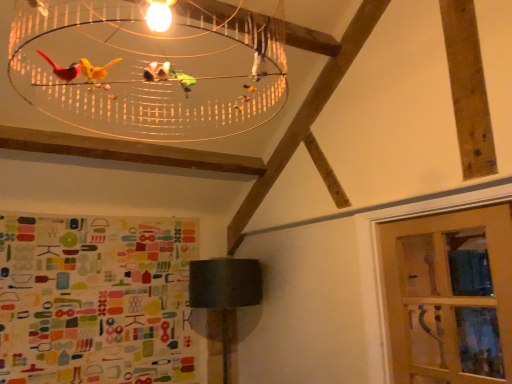
What is the approximate width of translucent plastic birdcage at upper center?

28.00 inches.

The image size is (512, 384). Describe the element at coordinates (225, 291) in the screenshot. I see `matte black lampshade at lower center` at that location.

Describe the element at coordinates (450, 296) in the screenshot. I see `clear glass door at lower right` at that location.

Find the location of `translucent plastic birdcage at upper center`. translucent plastic birdcage at upper center is located at coordinates (149, 70).

Between clear glass door at lower right and translucent plastic birdcage at upper center, which one appears on the left side from the viewer's perspective?

translucent plastic birdcage at upper center is more to the left.

From a real-world perspective, relative to translucent plastic birdcage at upper center, is clear glass door at lower right vertically above or below?

clear glass door at lower right is below translucent plastic birdcage at upper center.

Is clear glass door at lower right in contact with translucent plastic birdcage at upper center?

clear glass door at lower right and translucent plastic birdcage at upper center are not in contact.

Image resolution: width=512 pixels, height=384 pixels. Find the location of `door beneath the translucent plastic birdcage at upper center (from a real-world perspective)`. door beneath the translucent plastic birdcage at upper center (from a real-world perspective) is located at coordinates (450, 296).

Which of these two, translucent plastic birdcage at upper center or matte black lampshade at lower center, is smaller?

Smaller between the two is matte black lampshade at lower center.

How distant is translucent plastic birdcage at upper center from matte black lampshade at lower center?

translucent plastic birdcage at upper center is 1.60 meters from matte black lampshade at lower center.

Is translucent plastic birdcage at upper center shorter than matte black lampshade at lower center?

Indeed, translucent plastic birdcage at upper center has a lesser height compared to matte black lampshade at lower center.

From the image's perspective, which one is positioned higher, translucent plastic birdcage at upper center or matte black lampshade at lower center?

translucent plastic birdcage at upper center, from the image's perspective.

Is clear glass door at lower right with matte black lampshade at lower center?

There is a gap between clear glass door at lower right and matte black lampshade at lower center.

Who is smaller, clear glass door at lower right or matte black lampshade at lower center?

Smaller between the two is clear glass door at lower right.

From a real-world perspective, is clear glass door at lower right above or below matte black lampshade at lower center?

Clearly, from a real-world perspective, clear glass door at lower right is above matte black lampshade at lower center.

Considering the relative positions of clear glass door at lower right and matte black lampshade at lower center in the image provided, is clear glass door at lower right to the left of matte black lampshade at lower center from the viewer's perspective?

In fact, clear glass door at lower right is to the right of matte black lampshade at lower center.

Is matte black lampshade at lower center to the left of translucent plastic birdcage at upper center from the viewer's perspective?

Indeed, matte black lampshade at lower center is positioned on the left side of translucent plastic birdcage at upper center.

From the image's perspective, does matte black lampshade at lower center appear higher than translucent plastic birdcage at upper center?

Actually, matte black lampshade at lower center appears below translucent plastic birdcage at upper center in the image.

Is matte black lampshade at lower center positioned far away from translucent plastic birdcage at upper center?

Yes, matte black lampshade at lower center and translucent plastic birdcage at upper center are located far from each other.

Based on the photo, is matte black lampshade at lower center shorter than translucent plastic birdcage at upper center?

No.

Is matte black lampshade at lower center looking in the opposite direction of clear glass door at lower right?

No, clear glass door at lower right is not at the back of matte black lampshade at lower center.

Is point (201, 280) positioned before point (455, 224)?

No, it is behind (455, 224).

From their relative heights in the image, would you say matte black lampshade at lower center is taller or shorter than clear glass door at lower right?

matte black lampshade at lower center is taller than clear glass door at lower right.

From a real-world perspective, relative to clear glass door at lower right, is matte black lampshade at lower center vertically above or below?

In terms of real-world spatial position, matte black lampshade at lower center is below clear glass door at lower right.

Is translucent plastic birdcage at upper center oriented away from clear glass door at lower right?

No, translucent plastic birdcage at upper center's orientation is not away from clear glass door at lower right.

Based on the photo, considering the sizes of objects translucent plastic birdcage at upper center and clear glass door at lower right in the image provided, who is thinner, translucent plastic birdcage at upper center or clear glass door at lower right?

With smaller width is clear glass door at lower right.

Considering the sizes of objects translucent plastic birdcage at upper center and clear glass door at lower right in the image provided, who is shorter, translucent plastic birdcage at upper center or clear glass door at lower right?

translucent plastic birdcage at upper center.

You are a GUI agent. You are given a task and a screenshot of the screen. Output one action in this format:
    pyautogui.click(x=<x>, y=<y>)
    Task: Click on the door that is on the right side of translucent plastic birdcage at upper center
    This screenshot has height=384, width=512.
    Given the screenshot: What is the action you would take?
    pyautogui.click(x=450, y=296)

Image resolution: width=512 pixels, height=384 pixels. What are the coordinates of `table lamp below the translucent plastic birdcage at upper center (from the image's perspective)` in the screenshot? It's located at (225, 291).

In the scene shown: When comparing their distances from matte black lampshade at lower center, does clear glass door at lower right or translucent plastic birdcage at upper center seem further?

Among the two, clear glass door at lower right is located further to matte black lampshade at lower center.

Consider the image. Estimate the real-world distances between objects in this image. Which object is further from matte black lampshade at lower center, translucent plastic birdcage at upper center or clear glass door at lower right?

Among the two, clear glass door at lower right is located further to matte black lampshade at lower center.

Looking at the image, which one is located further to clear glass door at lower right, matte black lampshade at lower center or translucent plastic birdcage at upper center?

translucent plastic birdcage at upper center is positioned further to the anchor clear glass door at lower right.

Estimate the real-world distances between objects in this image. Which object is further from translucent plastic birdcage at upper center, matte black lampshade at lower center or clear glass door at lower right?

clear glass door at lower right is positioned further to the anchor translucent plastic birdcage at upper center.

Based on their spatial positions, is clear glass door at lower right or matte black lampshade at lower center further from translucent plastic birdcage at upper center?

clear glass door at lower right.

When comparing their distances from clear glass door at lower right, does translucent plastic birdcage at upper center or matte black lampshade at lower center seem closer?

matte black lampshade at lower center.

Locate an element on the screen. This screenshot has width=512, height=384. door between translucent plastic birdcage at upper center and matte black lampshade at lower center from front to back is located at coordinates (450, 296).